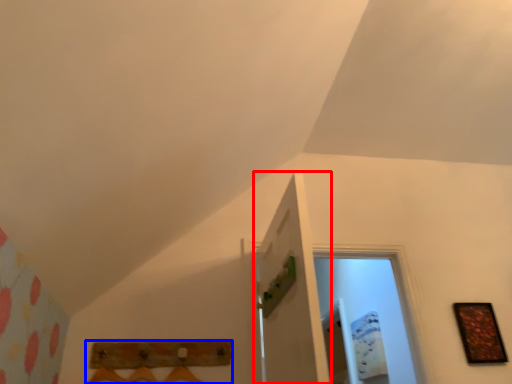
Question: Which of the following is the closest to the observer, door (highlighted by a red box) or furniture (highlighted by a blue box)?

Choices:
 (A) door
 (B) furniture

Answer: (A)